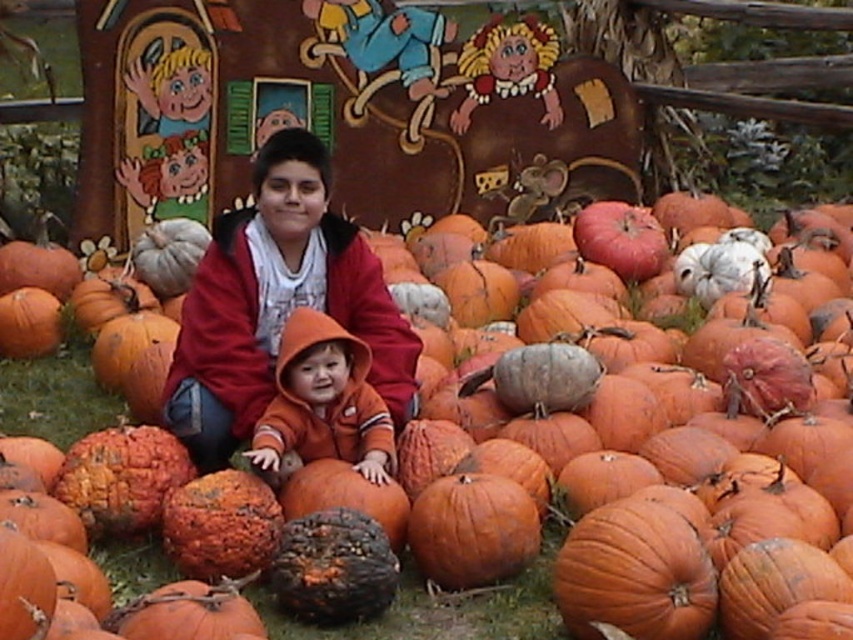
Question: In this image, where is orange matte pumpkin at center located relative to orange fleece hoodie at center?

Choices:
 (A) right
 (B) left

Answer: (B)

Question: Which point appears closest to the camera in this image?

Choices:
 (A) (335, 356)
 (B) (16, 372)
 (C) (248, 220)

Answer: (A)

Question: Does matte red hoodie at center come behind orange matte pumpkin at center?

Choices:
 (A) yes
 (B) no

Answer: (B)

Question: Considering the relative positions of matte red hoodie at center and orange matte pumpkin at center in the image provided, where is matte red hoodie at center located with respect to orange matte pumpkin at center?

Choices:
 (A) above
 (B) below

Answer: (A)

Question: Which of these objects is positioned farthest from the matte red hoodie at center?

Choices:
 (A) orange matte pumpkin at center
 (B) orange fleece hoodie at center

Answer: (A)

Question: Among these points, which one is farthest from the camera?

Choices:
 (A) (264, 262)
 (B) (511, 628)

Answer: (A)